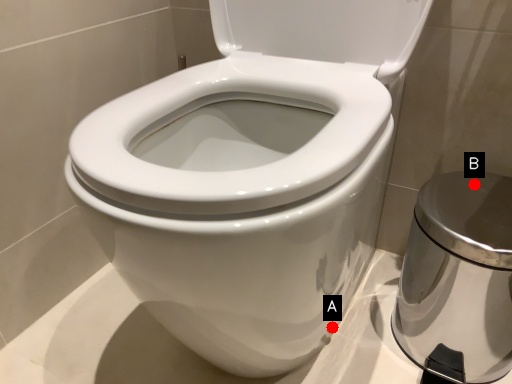
Question: Two points are circled on the image, labeled by A and B beside each circle. Among these points, which one is farthest from the camera?

Choices:
 (A) A is further
 (B) B is further

Answer: (B)